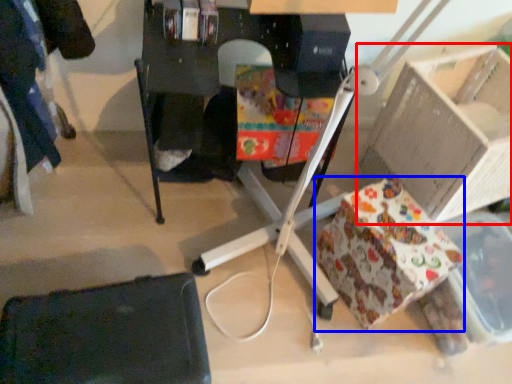
Question: Among these objects, which one is farthest to the camera, cardboard box (highlighted by a red box) or wrapping paper (highlighted by a blue box)?

Choices:
 (A) cardboard box
 (B) wrapping paper

Answer: (B)